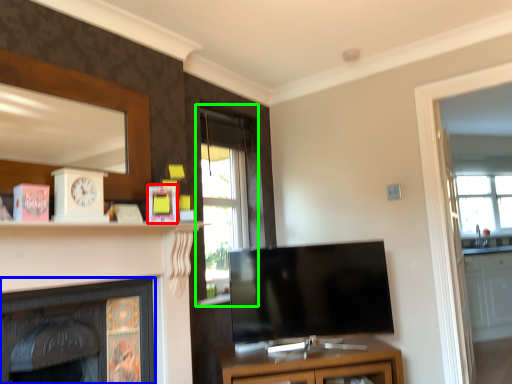
Question: Estimate the real-world distances between objects in this image. Which object is farther from picture frame (highlighted by a red box), fireplace (highlighted by a blue box) or window (highlighted by a green box)?

Choices:
 (A) fireplace
 (B) window

Answer: (B)